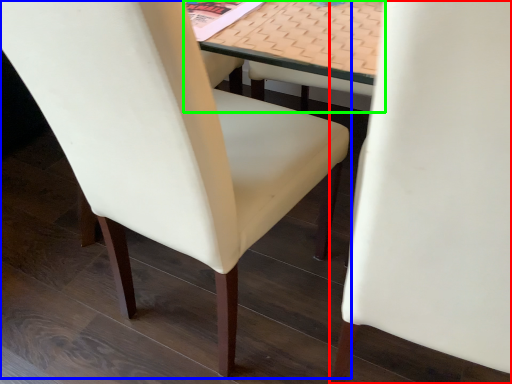
Question: Which object is positioned farthest from chair (highlighted by a red box)? Select from chair (highlighted by a blue box) and table (highlighted by a green box).

Choices:
 (A) chair
 (B) table

Answer: (A)